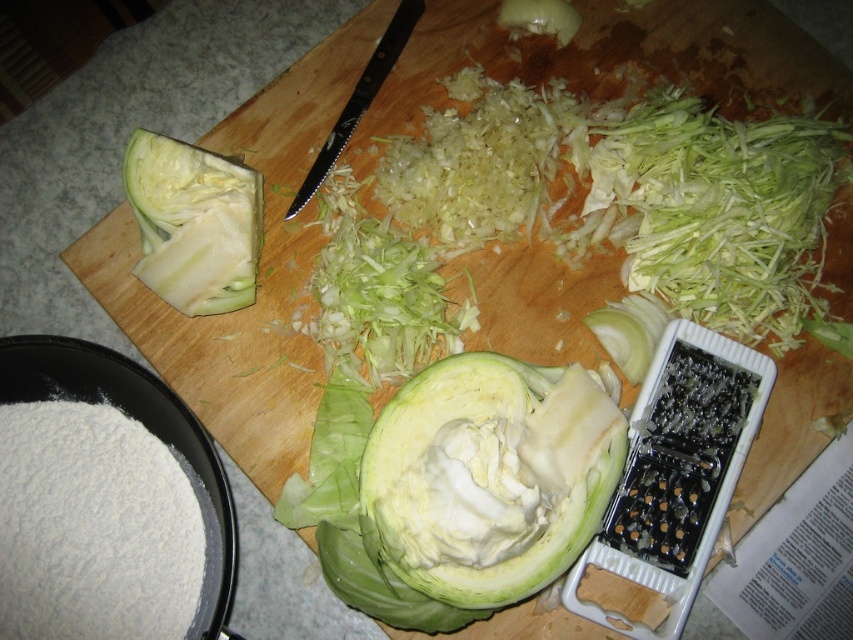
You are standing in the kitchen looking at the scene. There are two points marked in the image. The first point is at coordinate point(x=505, y=561) and the second point is at coordinate point(x=575, y=17). Which point is closer to you?

Point(x=505, y=561) is in front of point(x=575, y=17), so the first point is closer to you.

You are a chef standing in front of the kitchen counter where the green crisp cabbage at center is placed. You need to grab a knife that is 15 centimeters long to cut the cabbage. Can you comfortably reach the knife if it is placed 90 centimeters away from you?

The distance between the green crisp cabbage at center and the viewer is 90.45 centimeters. Since the knife is placed 90 centimeters away, it is within a comfortable reaching distance for the chef.